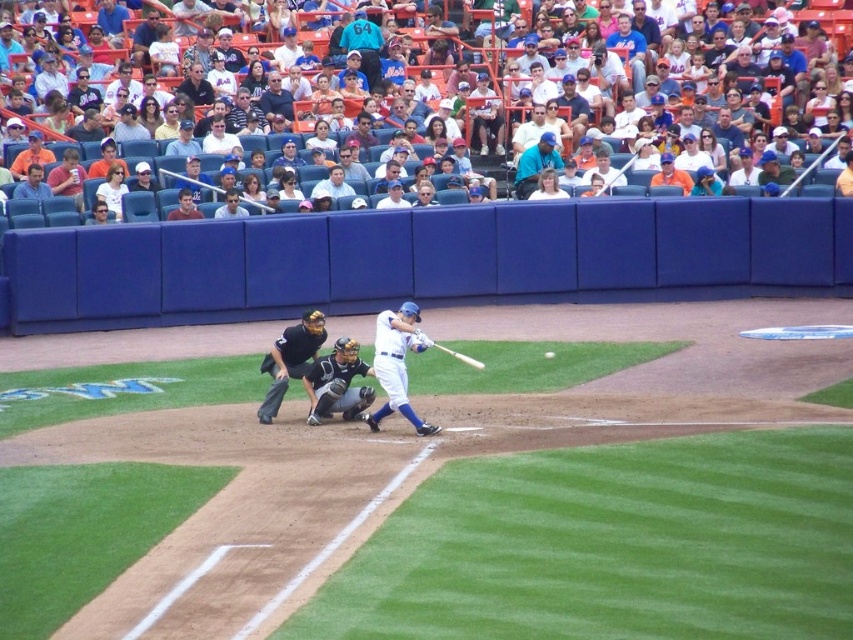
Does black leather umpire at center appear under blue baseball cap at upper center?

Yes, black leather umpire at center is below blue baseball cap at upper center.

Does point (318, 340) come closer to viewer compared to point (514, 164)?

Yes.

Find the location of a particular element. The image size is (853, 640). black leather umpire at center is located at coordinates (289, 358).

Identify the location of black leather umpire at center. (289, 358).

This screenshot has width=853, height=640. Find the location of `white jersey at upper center`. white jersey at upper center is located at coordinates [x=602, y=170].

Can you confirm if white jersey at upper center is positioned to the left of dark brown leather glove at center?

No, white jersey at upper center is not to the left of dark brown leather glove at center.

Find the location of a particular element. white jersey at upper center is located at coordinates (602, 170).

The height and width of the screenshot is (640, 853). I want to click on white jersey at upper center, so click(602, 170).

Is white matte baseball bat at center to the left of white baseball cap at center from the viewer's perspective?

In fact, white matte baseball bat at center is to the right of white baseball cap at center.

Who is more forward, (404, 362) or (393, 196)?

Positioned in front is point (404, 362).

Is point (378, 360) positioned before point (393, 179)?

Yes, it is in front of point (393, 179).

This screenshot has height=640, width=853. In order to click on white matte baseball bat at center in this screenshot , I will do `click(397, 364)`.